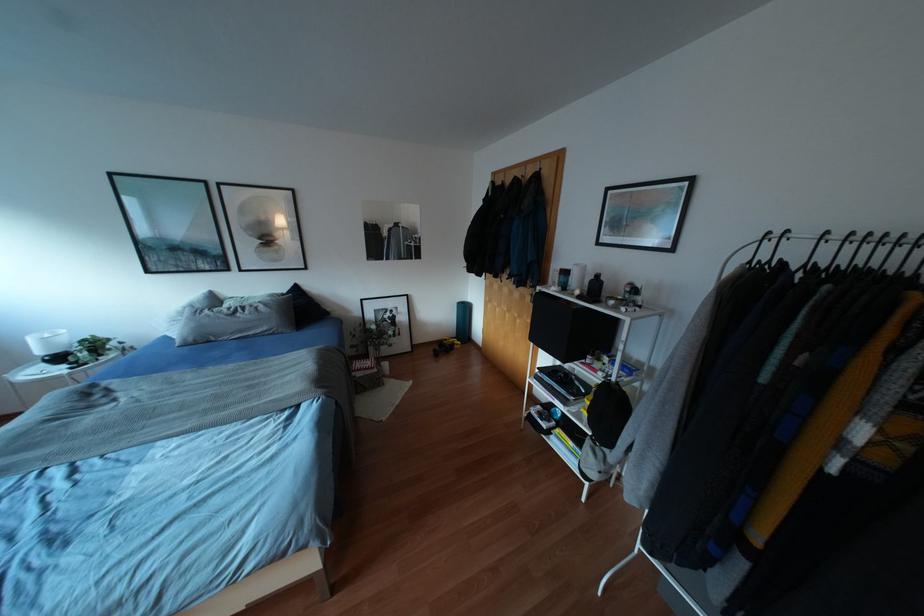
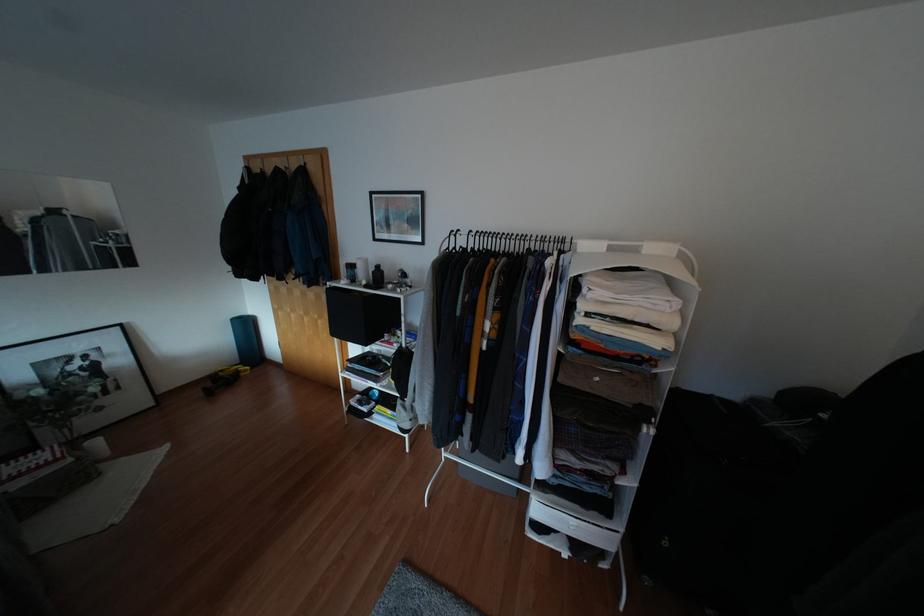
In the second image, find the point that corresponds to point 577,292 in the first image.

(362, 282)